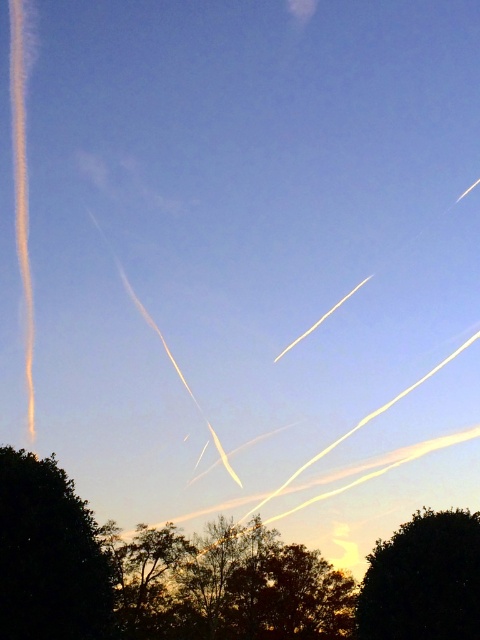
Can you confirm if dark green leafy tree at lower left is positioned to the right of green leafy tree at lower right?

In fact, dark green leafy tree at lower left is to the left of green leafy tree at lower right.

Who is taller, dark green leafy tree at lower left or green leafy tree at lower right?

With more height is dark green leafy tree at lower left.

Who is more distant from viewer, (22, 618) or (443, 532)?

The point (443, 532) is behind.

Find the location of a particular element. The width and height of the screenshot is (480, 640). dark green leafy tree at lower left is located at coordinates (48, 556).

Between green leafy tree at lower right and brown textured tree at center, which one is positioned lower?

brown textured tree at center is below.

Can you confirm if green leafy tree at lower right is positioned below brown textured tree at center?

Incorrect, green leafy tree at lower right is not positioned below brown textured tree at center.

Is point (417, 525) farther from viewer compared to point (144, 593)?

No.

Where is `green leafy tree at lower right`? This screenshot has width=480, height=640. green leafy tree at lower right is located at coordinates (423, 580).

How distant is green leafy tree at lower center from dark green leafy tree at lower left?

The distance of green leafy tree at lower center from dark green leafy tree at lower left is 105.42 feet.

Does green leafy tree at lower center have a greater width compared to dark green leafy tree at lower left?

Yes, green leafy tree at lower center is wider than dark green leafy tree at lower left.

This screenshot has height=640, width=480. Describe the element at coordinates (226, 586) in the screenshot. I see `green leafy tree at lower center` at that location.

At what (x,y) coordinates should I click in order to perform the action: click on green leafy tree at lower center. Please return your answer as a coordinate pair (x, y). This screenshot has height=640, width=480. Looking at the image, I should click on (x=226, y=586).